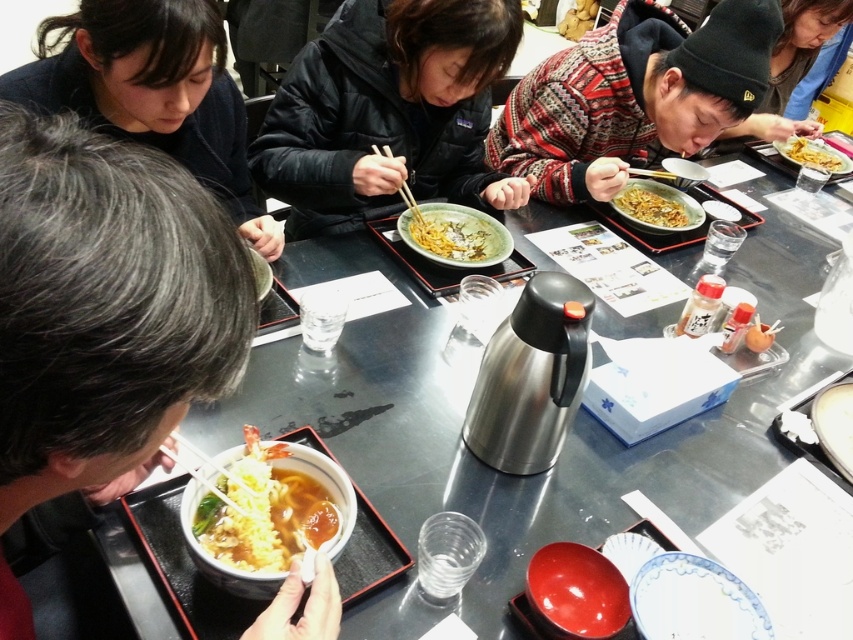
Question: Which point is farther to the camera?

Choices:
 (A) (39, 332)
 (B) (743, 54)
 (C) (790, 51)

Answer: (C)

Question: Is dark brown hair at lower left further to the viewer compared to yellowish glossy noodles at center?

Choices:
 (A) yes
 (B) no

Answer: (B)

Question: Is metallic stainless steel table at center bigger than shiny yellow noodles at upper right?

Choices:
 (A) yes
 (B) no

Answer: (A)

Question: Estimate the real-world distances between objects in this image. Which object is farther from the knitted sweater at center?

Choices:
 (A) black matte jacket at center
 (B) metallic stainless steel table at center
 (C) dark brown hair at lower left

Answer: (C)

Question: Which object is the closest to the shiny yellow noodles at bottom left?

Choices:
 (A) black matte hair at upper left
 (B) dark brown hair at lower left

Answer: (B)

Question: Does black matte jacket at center appear under shiny yellow noodles at bottom left?

Choices:
 (A) no
 (B) yes

Answer: (A)